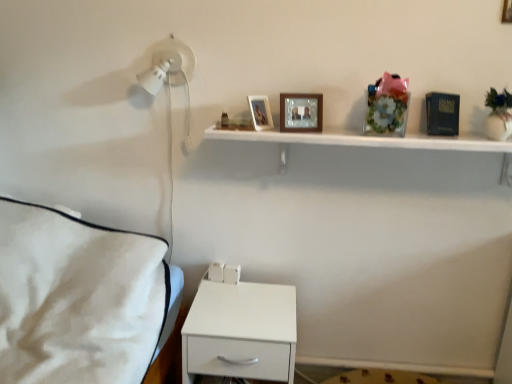
The image size is (512, 384). Identify the location of vacant space to the right of wooden picture frame at upper center, which ranks as the first picture frame in bottom-to-top order. (343, 134).